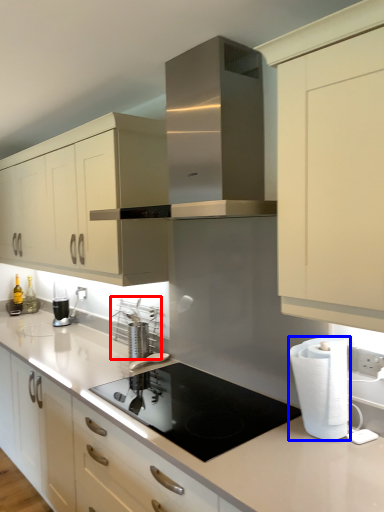
Question: Which object is further to the camera taking this photo, appliance (highlighted by a red box) or paper towel (highlighted by a blue box)?

Choices:
 (A) appliance
 (B) paper towel

Answer: (A)